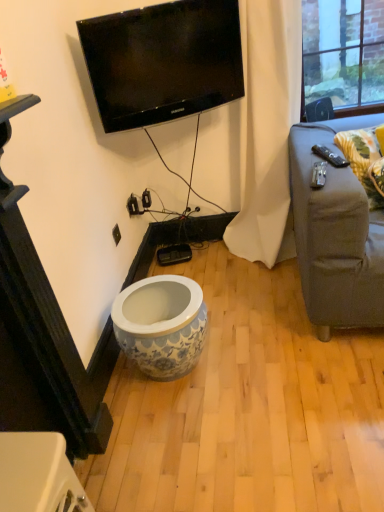
Question: Would you say white fabric curtain at center is a long distance from yellow floral fabric pillow at right?

Choices:
 (A) no
 (B) yes

Answer: (A)

Question: Is white fabric curtain at center bigger than yellow floral fabric pillow at right?

Choices:
 (A) yes
 (B) no

Answer: (A)

Question: Could you tell me if white fabric curtain at center is turned towards yellow floral fabric pillow at right?

Choices:
 (A) yes
 (B) no

Answer: (B)

Question: Is white fabric curtain at center taller than yellow floral fabric pillow at right?

Choices:
 (A) yes
 (B) no

Answer: (A)

Question: Is white fabric curtain at center not inside yellow floral fabric pillow at right?

Choices:
 (A) yes
 (B) no

Answer: (A)

Question: Is yellow floral fabric pillow at right spatially inside blue and white ceramic vase at center, or outside of it?

Choices:
 (A) outside
 (B) inside

Answer: (A)

Question: Is point (339, 145) closer or farther from the camera than point (137, 336)?

Choices:
 (A) farther
 (B) closer

Answer: (A)

Question: Considering the positions of yellow floral fabric pillow at right and blue and white ceramic vase at center in the image, is yellow floral fabric pillow at right bigger or smaller than blue and white ceramic vase at center?

Choices:
 (A) big
 (B) small

Answer: (B)

Question: From the image's perspective, relative to blue and white ceramic vase at center, is yellow floral fabric pillow at right above or below?

Choices:
 (A) above
 (B) below

Answer: (A)

Question: From their relative heights in the image, would you say blue and white ceramic vase at center is taller or shorter than black glossy tv at upper center?

Choices:
 (A) short
 (B) tall

Answer: (A)

Question: Is blue and white ceramic vase at center inside or outside of black glossy tv at upper center?

Choices:
 (A) outside
 (B) inside

Answer: (A)

Question: Is blue and white ceramic vase at center bigger or smaller than black glossy tv at upper center?

Choices:
 (A) small
 (B) big

Answer: (B)

Question: Visually, is blue and white ceramic vase at center positioned to the left or to the right of black glossy tv at upper center?

Choices:
 (A) left
 (B) right

Answer: (A)

Question: Is white fabric curtain at center taller or shorter than black glossy tv at upper center?

Choices:
 (A) short
 (B) tall

Answer: (B)

Question: Relative to black glossy tv at upper center, is white fabric curtain at center in front or behind?

Choices:
 (A) behind
 (B) front

Answer: (A)